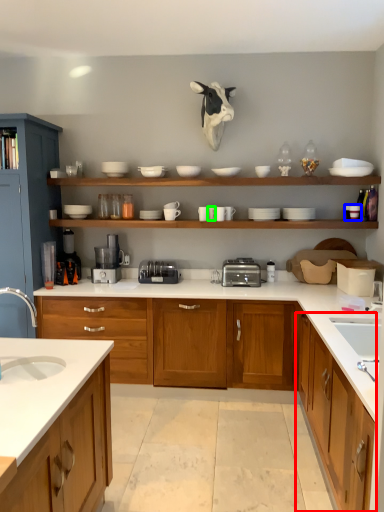
Question: Which object is positioned closest to cabinetry (highlighted by a red box)? Select from tableware (highlighted by a blue box) and tableware (highlighted by a green box).

Choices:
 (A) tableware
 (B) tableware

Answer: (A)